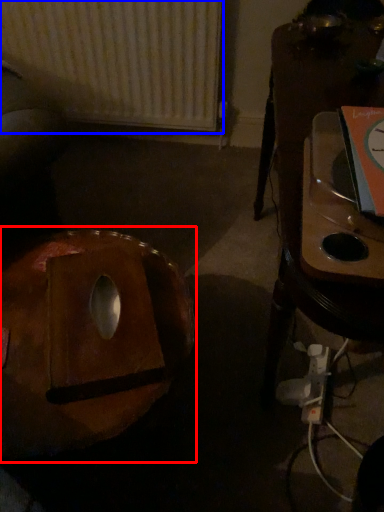
Question: Which of the following is the farthest to the observer, bean bag chair (highlighted by a red box) or radiator (highlighted by a blue box)?

Choices:
 (A) bean bag chair
 (B) radiator

Answer: (B)